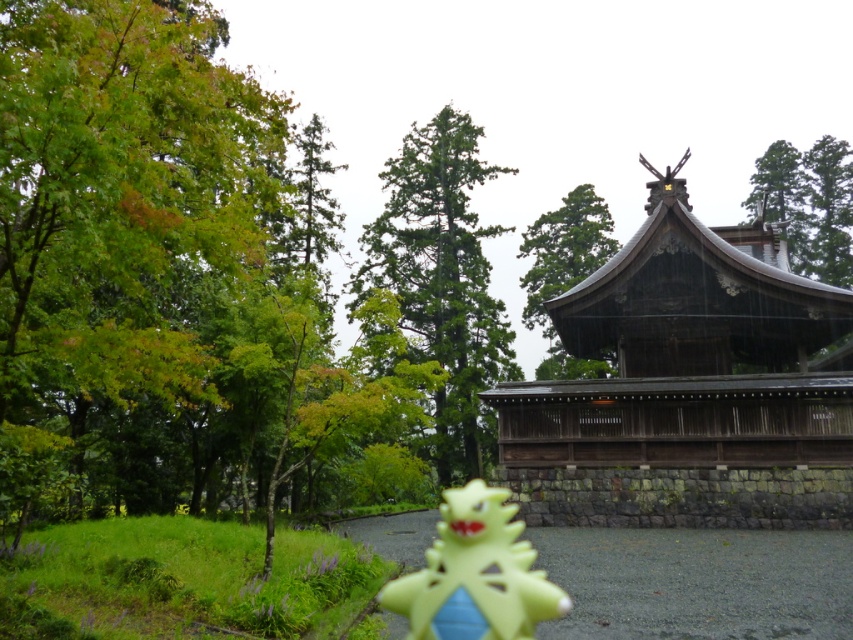
You are a visitor at the shrine and want to take a photo that includes both the green leafy tree at left and the green textured tree at center. Which tree should you position closer to the camera to ensure both are in focus?

To ensure both the green leafy tree at left and the green textured tree at center are in focus, position the green leafy tree at left closer to the camera since it is shorter than the green textured tree at center. This arrangement will help maintain depth of field for both subjects.

You are a visitor at the shrine and want to take a photo that includes both the green textured tree at center and the green textured tree at upper center. Which tree should you focus on to ensure both are in the frame?

You should focus on the green textured tree at upper center because it is shorter than the green textured tree at center, allowing both to fit within the frame when positioned appropriately.

You are a visitor at the shrine and want to take a photo that includes both the green textured tree at center and the green textured tree at upper center. Which tree should you position closer to the camera to ensure both are in the frame?

To include both the green textured tree at center and the green textured tree at upper center in your photo, position the green textured tree at center closer to the camera since it might be wider than the green textured tree at upper center, ensuring both fit within the frame.